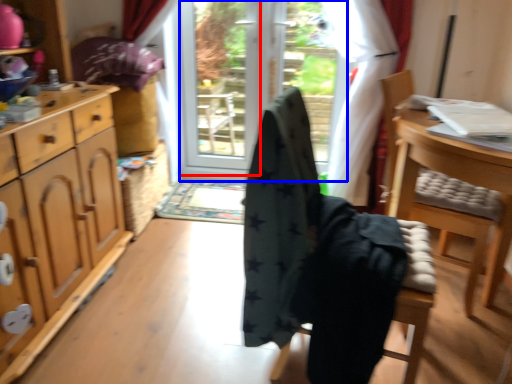
Question: Which of the following is the closest to the observer, screen door (highlighted by a red box) or screen door (highlighted by a blue box)?

Choices:
 (A) screen door
 (B) screen door

Answer: (B)